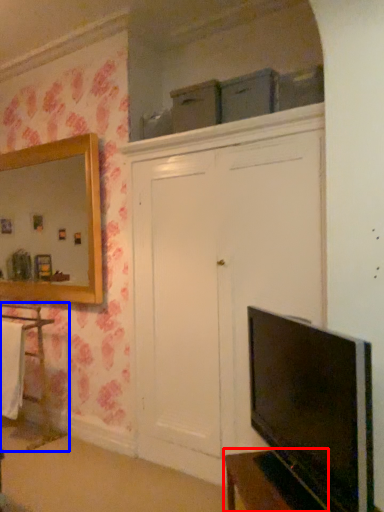
Question: Which point is closer to the camera, vanity (highlighted by a red box) or cabinetry (highlighted by a blue box)?

Choices:
 (A) vanity
 (B) cabinetry

Answer: (A)